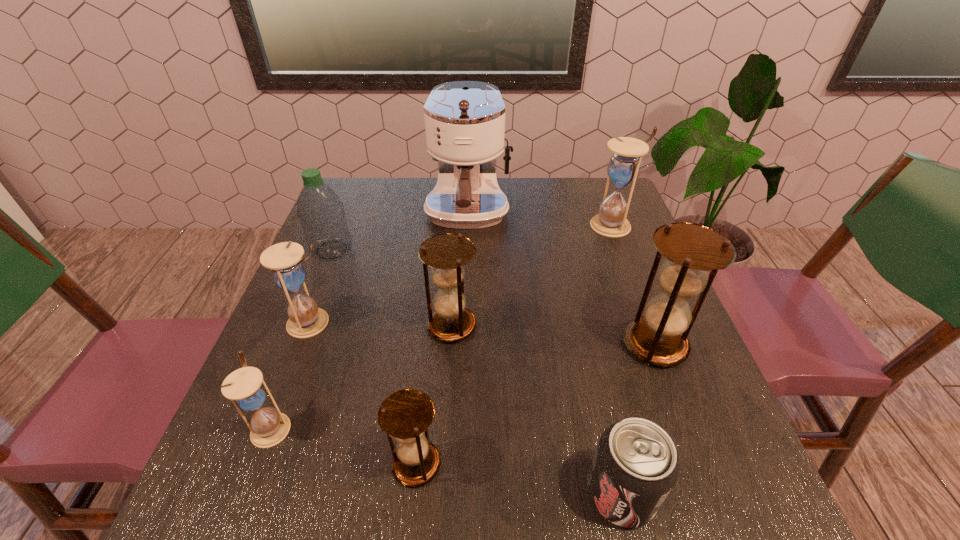
Find the location of a particular element. The height and width of the screenshot is (540, 960). the third object from right to left is located at coordinates (635, 466).

Identify the location of soda can. (635, 466).

You are a GUI agent. You are given a task and a screenshot of the screen. Output one action in this format:
    pyautogui.click(x=<x>, y=<y>)
    Task: Click on the vacant space located 0.380m on the front-facing side of the tallest object
    
    Given the screenshot: What is the action you would take?
    pyautogui.click(x=462, y=384)

Identify the location of vacant area situated on the left of the biggest white hourglass. This screenshot has height=540, width=960. (555, 225).

This screenshot has width=960, height=540. I want to click on free space located on the left of the biggest brown hourglass, so point(545,343).

Where is `vacant area located 0.130m on the right of the green water bottle`? This screenshot has width=960, height=540. vacant area located 0.130m on the right of the green water bottle is located at coordinates (403, 250).

This screenshot has height=540, width=960. In order to click on blank space located on the back of the second farthest white hourglass in this screenshot , I will do `click(345, 236)`.

At what (x,y) coordinates should I click in order to perform the action: click on vacant space situated 0.190m on the left of the second biggest brown hourglass. Please return your answer as a coordinate pair (x, y). The height and width of the screenshot is (540, 960). Looking at the image, I should click on (339, 326).

Locate an element on the screen. free space located on the back of the nearest white hourglass is located at coordinates (310, 325).

Where is `free spot located on the left of the nearest brown hourglass`? This screenshot has height=540, width=960. free spot located on the left of the nearest brown hourglass is located at coordinates (362, 464).